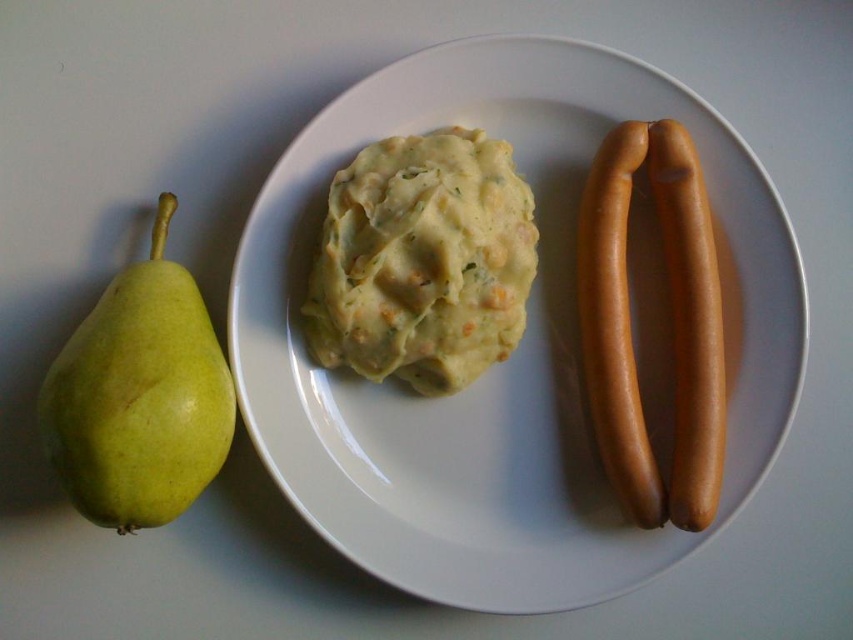
You are setting up a dinner plate and want to ensure proper spacing between the brown smooth hot dog at right and the green matte pear at left. Based on their positions, which object is closer to the edge of the plate?

The brown smooth hot dog at right is positioned over the green matte pear at left, meaning it is closer to the edge of the plate.

You are a chef standing in front of the white glossy plate at center and the brown smooth hot dog at right. Which object is closer to you?

The white glossy plate at center is closer to you than the brown smooth hot dog at right.